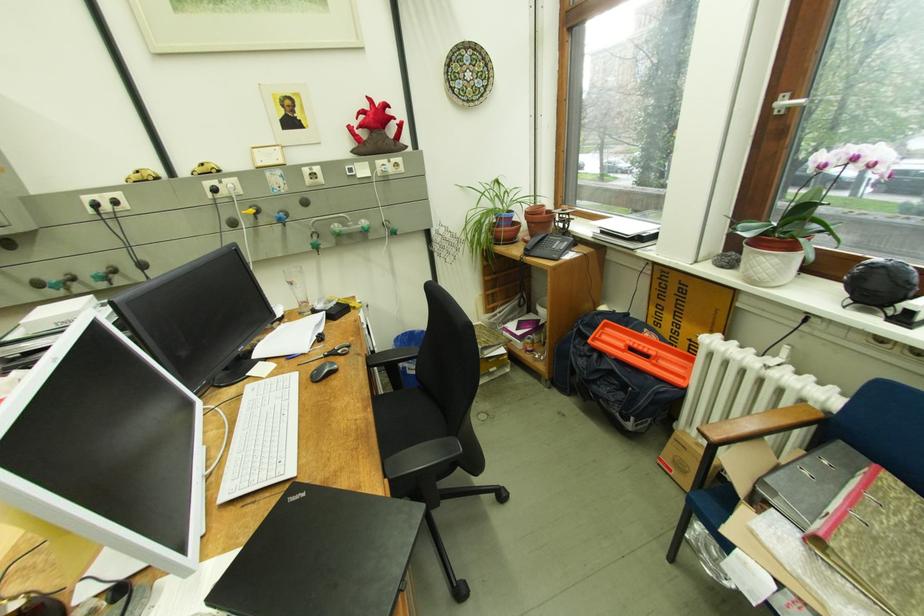
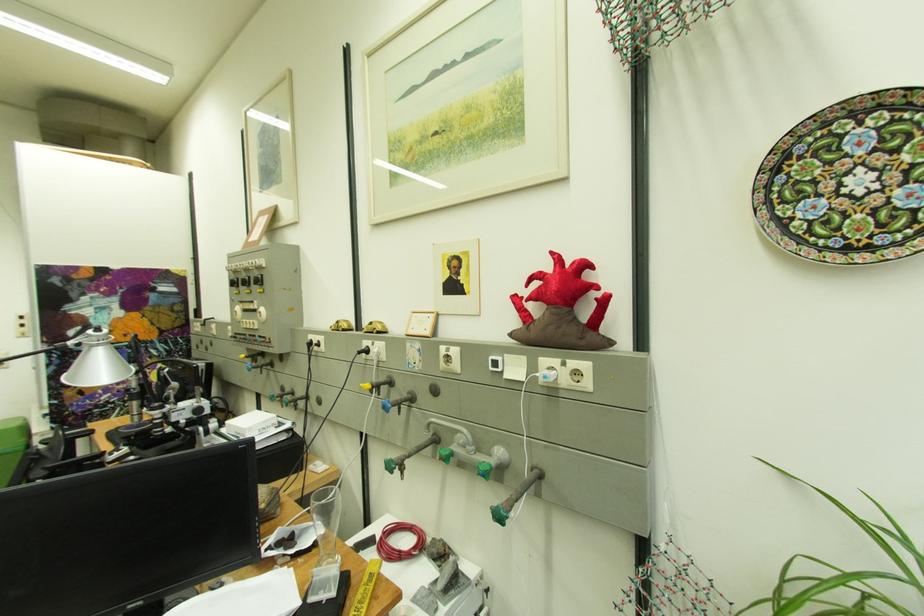
The point at (399, 161) is marked in the first image. Where is the corresponding point in the second image?

(575, 365)